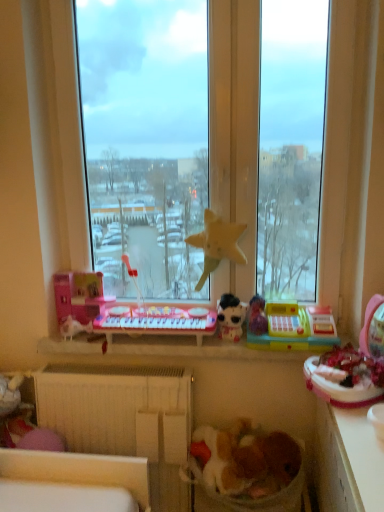
The image size is (384, 512). Identify the location of free spot above shiny pink plastic toy at center (from a real-world perspective). (158, 312).